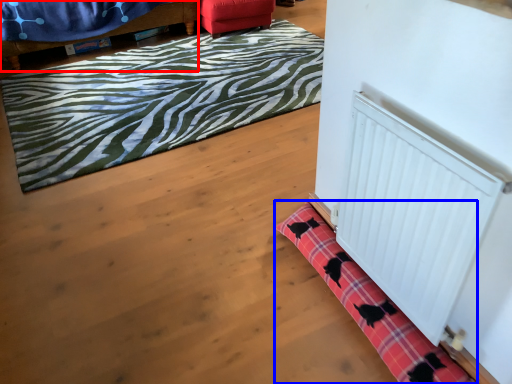
Question: Which of the following is the farthest to the observer, furniture (highlighted by a red box) or bath mat (highlighted by a blue box)?

Choices:
 (A) furniture
 (B) bath mat

Answer: (A)